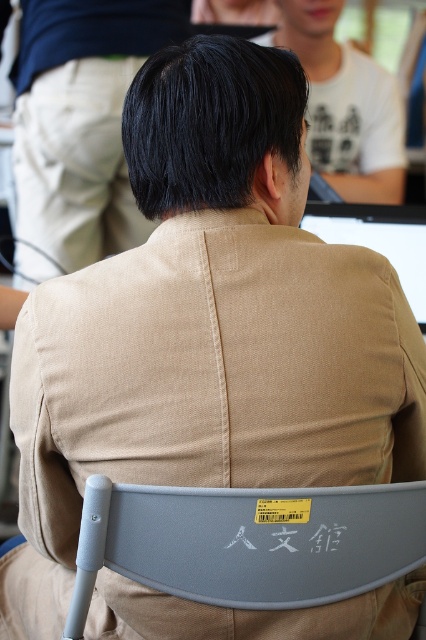
Who is more forward, (206, 589) or (420, 308)?

Point (206, 589) is in front.

Is gray plastic chair at lower center above matte black monitor at upper center?

No, gray plastic chair at lower center is not above matte black monitor at upper center.

Does point (236, 508) come closer to viewer compared to point (411, 236)?

That is True.

The image size is (426, 640). What are the coordinates of `gray plastic chair at lower center` in the screenshot? It's located at (256, 544).

Does point (363, 99) come farther from viewer compared to point (405, 276)?

That is True.

Between matte black hair at upper center and matte black monitor at upper center, which one is positioned higher?

matte black hair at upper center

Is point (351, 61) positioned in front of point (319, 216)?

No, (351, 61) is behind (319, 216).

This screenshot has height=640, width=426. In order to click on matte black hair at upper center in this screenshot , I will do `click(345, 106)`.

Between matte khaki shirt at upper center and matte black monitor at upper center, which one appears on the right side from the viewer's perspective?

Positioned to the right is matte black monitor at upper center.

Who is more distant from viewer, (x=37, y=192) or (x=324, y=225)?

Positioned behind is point (x=37, y=192).

Locate an element on the screen. matte khaki shirt at upper center is located at coordinates (81, 120).